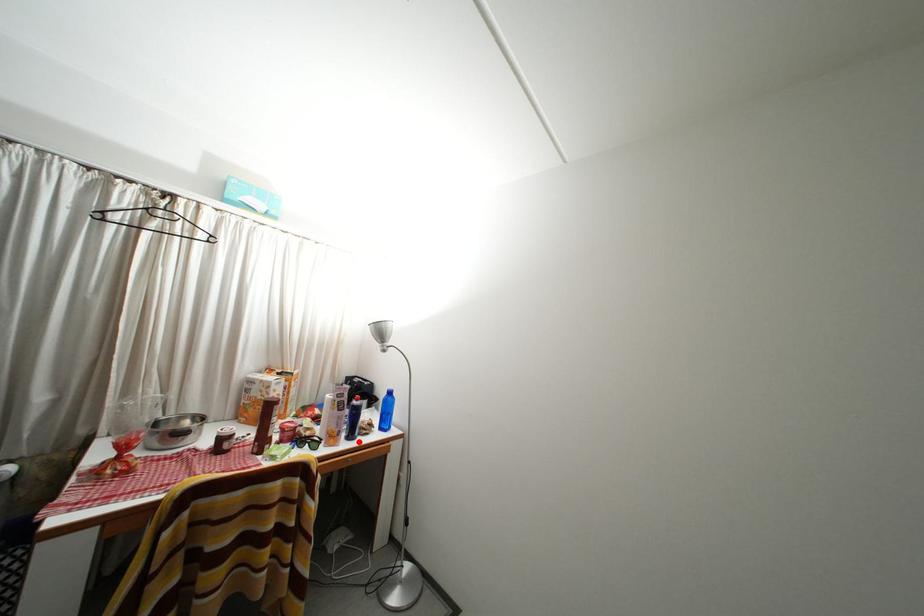
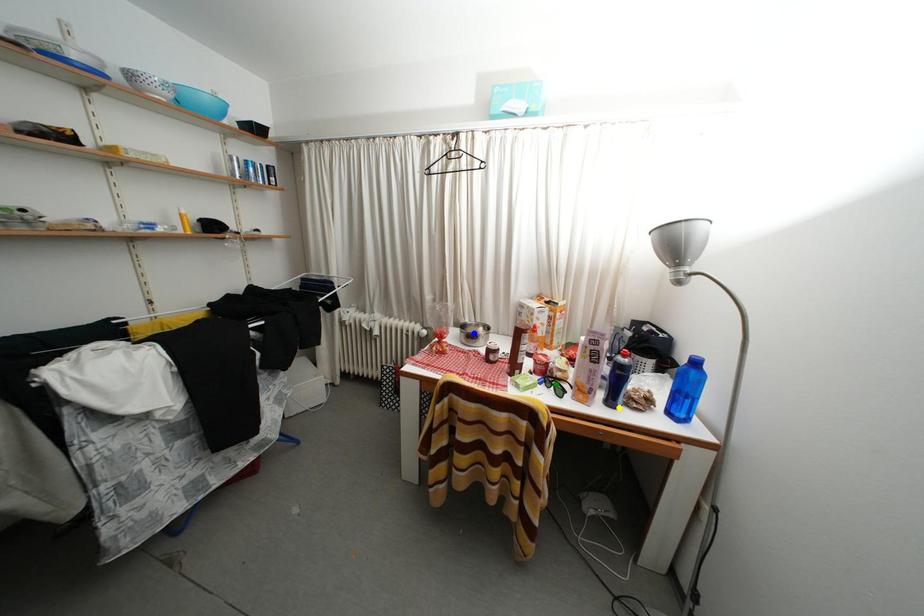
Question: I am providing you with two images of the same scene from different viewpoints. A red point is marked on the first image. You are given multiple points on the second image. Which spot in image 2 lines up with the point in image 1?

Choices:
 (A) blue point
 (B) yellow point
 (C) green point

Answer: (B)